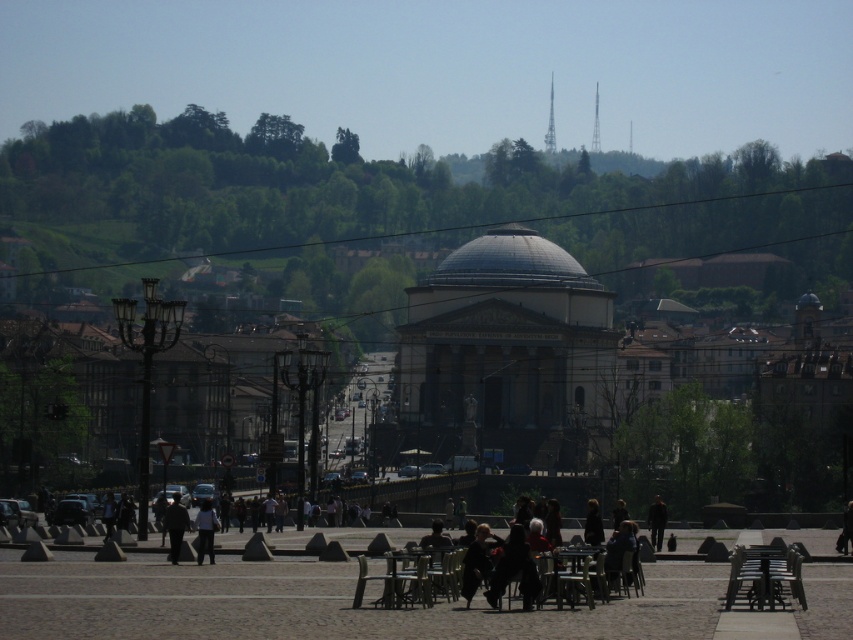
You are a photographer trying to capture a clear shot of both the dark brown leather jacket at lower center and the dark brown leather jacket at center. However, you notice that one of them might be partially hidden by the other. Which jacket is more likely to be visible in your photo?

The dark brown leather jacket at center is taller than the dark brown leather jacket at lower center, so the jacket at center will be more visible in the photo.

You are a photographer aiming to capture both the dark brown leather jacket at lower center and the dark brown leather jacket at center in a single frame. Given their sizes, which jacket will appear smaller in your photo?

The dark brown leather jacket at lower center will appear smaller in the photo because it has a smaller size compared to the dark brown leather jacket at center.

You are a photographer standing in the plaza and notice two jackets hanging on chairs. The jackets are the dark brown leather jacket at lower right and the dark gray jacket at lower center. Which jacket is closer to the ground?

The dark brown leather jacket at lower right is positioned under the dark gray jacket at lower center, so it is closer to the ground.